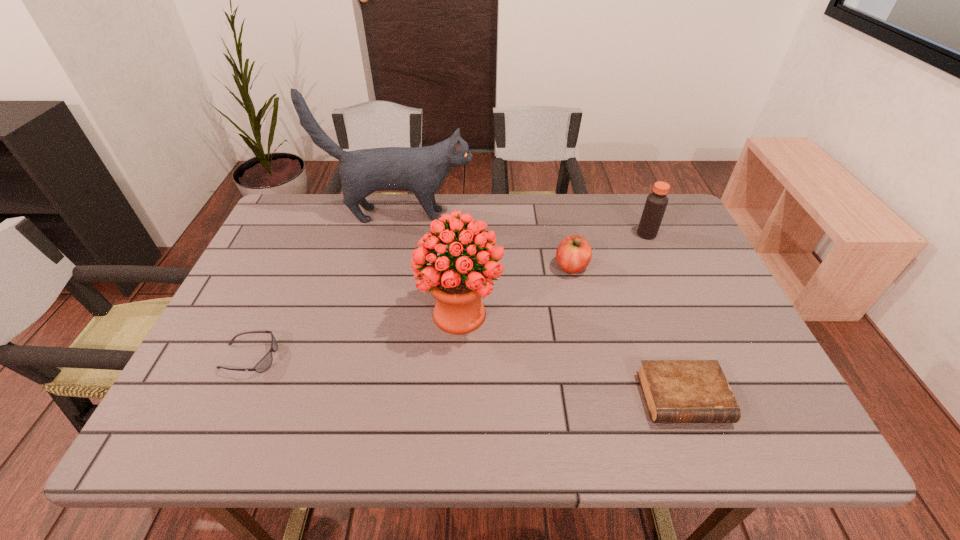
Where is `vacant space situated 0.050m on the left of the fifth shortest object`? This screenshot has width=960, height=540. vacant space situated 0.050m on the left of the fifth shortest object is located at coordinates (397, 314).

At what (x,y) coordinates should I click in order to perform the action: click on free space located on the left of the fourth shortest object. Please return your answer as a coordinate pair (x, y). The image size is (960, 540). Looking at the image, I should click on (570, 234).

This screenshot has height=540, width=960. I want to click on vacant space located 0.280m on the front of the fourth object from left to right, so click(593, 367).

Where is `vacant space situated on the lenses of the sunglasses`? This screenshot has height=540, width=960. vacant space situated on the lenses of the sunglasses is located at coordinates (334, 357).

Where is `cat positioned at the far edge`? The image size is (960, 540). cat positioned at the far edge is located at coordinates (422, 170).

Where is `vinegar located in the far edge section of the desktop`? Image resolution: width=960 pixels, height=540 pixels. vinegar located in the far edge section of the desktop is located at coordinates (656, 202).

Locate an element on the screen. object at the near edge is located at coordinates 676,391.

Find the location of a particular element. Image resolution: width=960 pixels, height=540 pixels. cat positioned at the left edge is located at coordinates (422, 170).

I want to click on sunglasses positioned at the left edge, so click(264, 364).

The image size is (960, 540). I want to click on vinegar at the right edge, so click(656, 202).